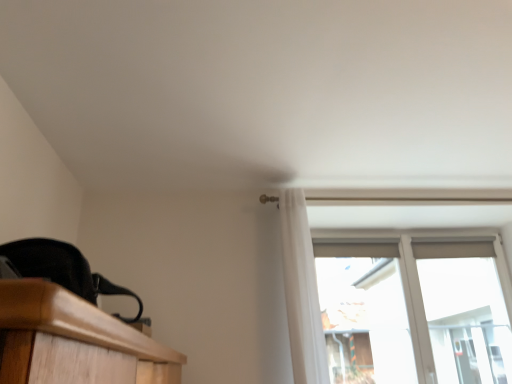
Measure the distance between transparent glass window at upper right and camera.

transparent glass window at upper right and camera are 5.14 meters apart from each other.

The image size is (512, 384). Describe the element at coordinates (396, 302) in the screenshot. I see `transparent glass window at upper right` at that location.

The width and height of the screenshot is (512, 384). In order to click on transparent glass window at upper right in this screenshot , I will do `click(396, 302)`.

You are a GUI agent. You are given a task and a screenshot of the screen. Output one action in this format:
    pyautogui.click(x=<x>, y=<y>)
    Task: Click on the white sheer curtain at upper center
    The image size is (512, 384).
    Given the screenshot: What is the action you would take?
    pyautogui.click(x=302, y=291)

This screenshot has width=512, height=384. What do you see at coordinates (302, 291) in the screenshot?
I see `white sheer curtain at upper center` at bounding box center [302, 291].

Measure the distance between white sheer curtain at upper center and camera.

They are 2.02 meters apart.

Identify the location of transparent glass window at upper right. The height and width of the screenshot is (384, 512). (396, 302).

Based on their positions, is white sheer curtain at upper center located to the left or right of transparent glass window at upper right?

From the image, it's evident that white sheer curtain at upper center is to the left of transparent glass window at upper right.

Which is behind, white sheer curtain at upper center or transparent glass window at upper right?

transparent glass window at upper right is more distant.

Considering the positions of point (305, 367) and point (495, 278), is point (305, 367) closer or farther from the camera than point (495, 278)?

Point (305, 367) appears to be closer to the viewer than point (495, 278).

From the image's perspective, is white sheer curtain at upper center located beneath transparent glass window at upper right?

Actually, white sheer curtain at upper center appears above transparent glass window at upper right in the image.

From a real-world perspective, is white sheer curtain at upper center positioned above or below transparent glass window at upper right?

white sheer curtain at upper center is above transparent glass window at upper right.

Considering the sizes of objects white sheer curtain at upper center and transparent glass window at upper right in the image provided, who is wider, white sheer curtain at upper center or transparent glass window at upper right?

white sheer curtain at upper center.

Between white sheer curtain at upper center and transparent glass window at upper right, which one has less height?

white sheer curtain at upper center is shorter.

Which of these two, white sheer curtain at upper center or transparent glass window at upper right, is smaller?

white sheer curtain at upper center is smaller.

Would you say white sheer curtain at upper center is outside transparent glass window at upper right?

white sheer curtain at upper center lies outside transparent glass window at upper right's area.

Based on the photo, is white sheer curtain at upper center directly adjacent to transparent glass window at upper right?

No, white sheer curtain at upper center is not touching transparent glass window at upper right.

Is white sheer curtain at upper center aimed at transparent glass window at upper right?

No, white sheer curtain at upper center does not turn towards transparent glass window at upper right.

How different are the orientations of white sheer curtain at upper center and transparent glass window at upper right in degrees?

white sheer curtain at upper center and transparent glass window at upper right are facing 1.04 degrees away from each other.

Identify the location of window below the white sheer curtain at upper center (from the image's perspective). (396, 302).

In the image, is transparent glass window at upper right on the left side or the right side of white sheer curtain at upper center?

In the image, transparent glass window at upper right appears on the right side of white sheer curtain at upper center.

Is transparent glass window at upper right closer to the viewer compared to white sheer curtain at upper center?

No.

Which point is more distant from viewer, (293, 280) or (285, 207)?

Point (285, 207)

From the image's perspective, which object appears higher, transparent glass window at upper right or white sheer curtain at upper center?

white sheer curtain at upper center appears higher in the image.

From a real-world perspective, is transparent glass window at upper right under white sheer curtain at upper center?

Yes, from a real-world perspective, transparent glass window at upper right is beneath white sheer curtain at upper center.

In terms of width, does transparent glass window at upper right look wider or thinner when compared to white sheer curtain at upper center?

In the image, transparent glass window at upper right appears to be more narrow than white sheer curtain at upper center.

Is transparent glass window at upper right taller or shorter than white sheer curtain at upper center?

transparent glass window at upper right is taller than white sheer curtain at upper center.

Considering the sizes of transparent glass window at upper right and white sheer curtain at upper center in the image, is transparent glass window at upper right bigger or smaller than white sheer curtain at upper center?

transparent glass window at upper right is bigger than white sheer curtain at upper center.

Is transparent glass window at upper right situated inside white sheer curtain at upper center or outside?

transparent glass window at upper right is not inside white sheer curtain at upper center, it's outside.

Consider the image. Is there a large distance between transparent glass window at upper right and white sheer curtain at upper center?

transparent glass window at upper right is positioned a significant distance from white sheer curtain at upper center.

Is transparent glass window at upper right turned away from white sheer curtain at upper center?

No.

Locate an element on the screen. window below the white sheer curtain at upper center (from the image's perspective) is located at coordinates (396, 302).

The height and width of the screenshot is (384, 512). I want to click on window below the white sheer curtain at upper center (from a real-world perspective), so click(x=396, y=302).

This screenshot has height=384, width=512. Identify the location of window behind the white sheer curtain at upper center. (396, 302).